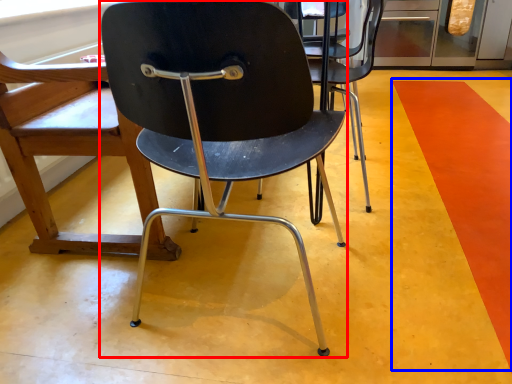
Question: Among these objects, which one is nearest to the camera, chair (highlighted by a red box) or strip (highlighted by a blue box)?

Choices:
 (A) chair
 (B) strip

Answer: (A)